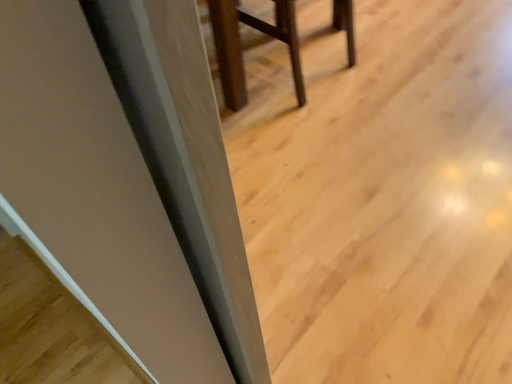
What is the approximate width of dark brown wood stool at upper center?

It is 17.87 inches.

In the scene shown: Measure the distance between point (279, 13) and camera.

A distance of 1.72 meters exists between point (279, 13) and camera.

The image size is (512, 384). Find the location of `dark brown wood stool at upper center`. dark brown wood stool at upper center is located at coordinates [x=241, y=46].

This screenshot has height=384, width=512. What do you see at coordinates (241, 46) in the screenshot? I see `dark brown wood stool at upper center` at bounding box center [241, 46].

Locate an element on the screen. The width and height of the screenshot is (512, 384). dark brown wood stool at upper center is located at coordinates (241, 46).